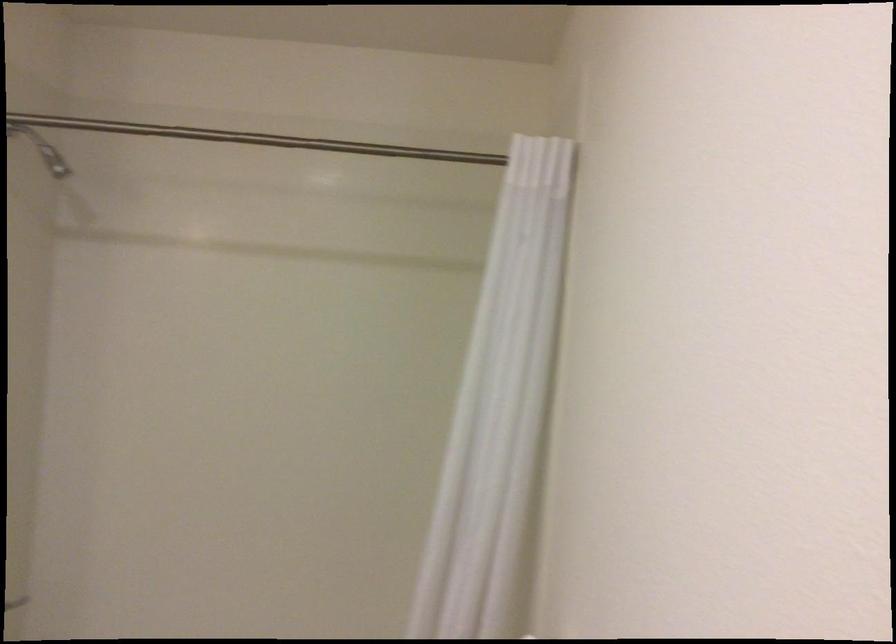
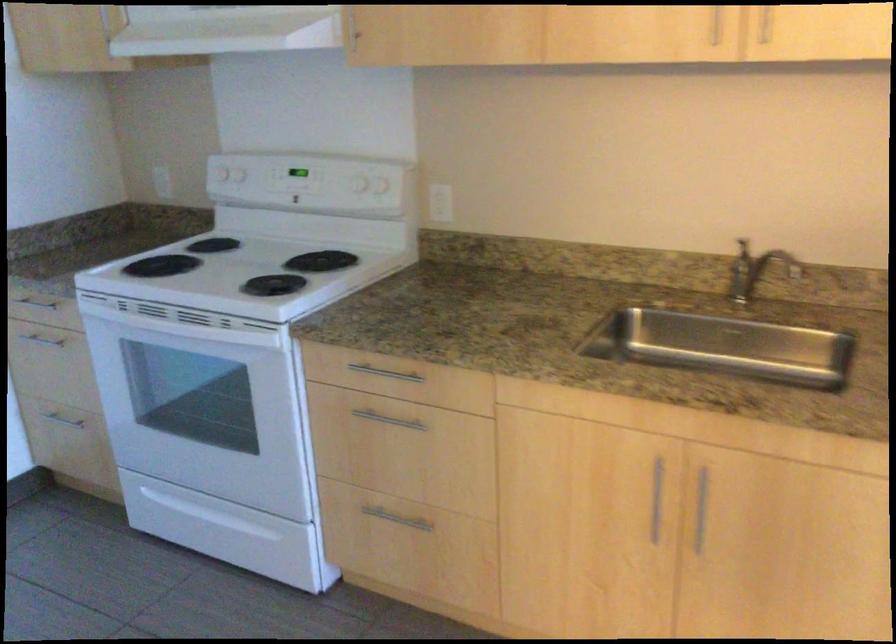
First-person continuous shooting, in which direction is the camera rotating?

The camera rotated toward right-down.